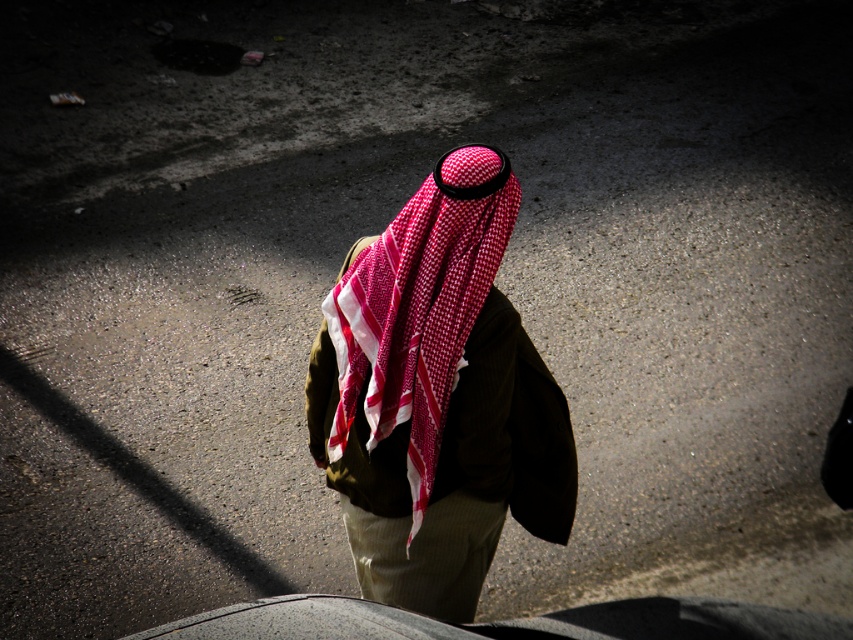
You are a security camera monitoring the scene. You notice a person wearing a red checkered headscarf at center and khaki fabric at center. Which item is closer to the camera?

The red checkered headscarf at center is closer to the camera because it is in front of the khaki fabric at center.

Based on the scene described, can you determine if the red checkered headscarf at center is wider than the khaki fabric at center?

The red checkered headscarf at center might be wider than khaki fabric at center according to the description provided.